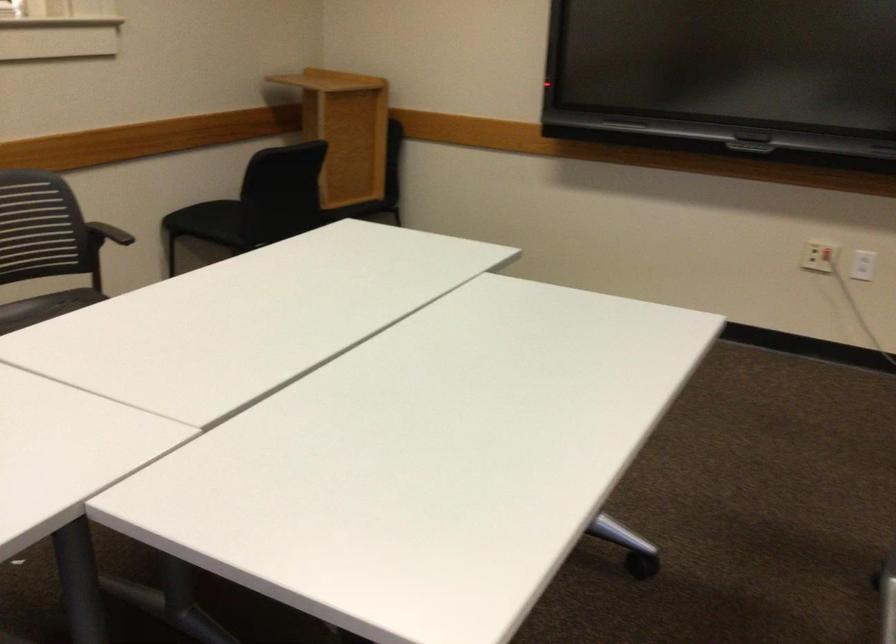
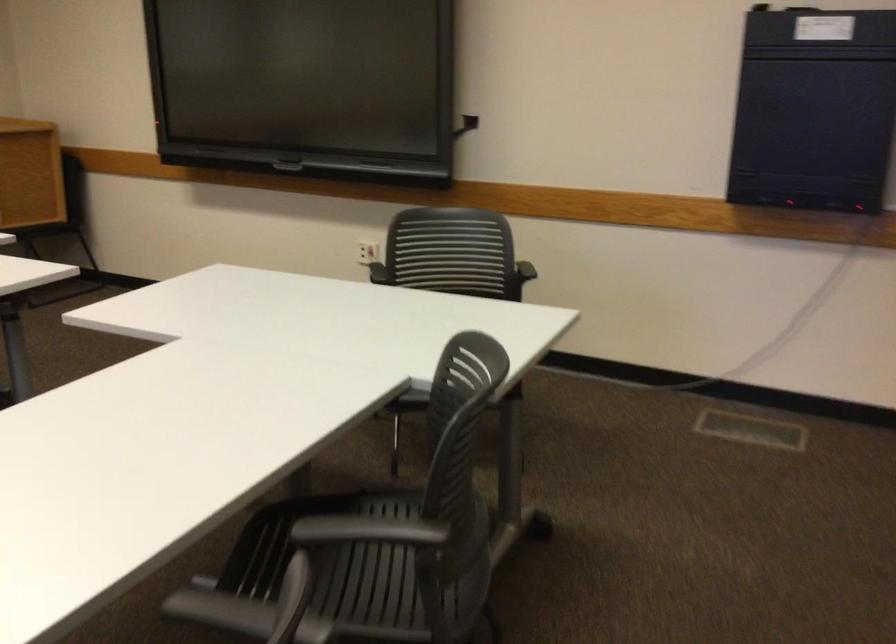
What movement of the cameraman would produce the second image?

The movement direction of the cameraman is right, backward.